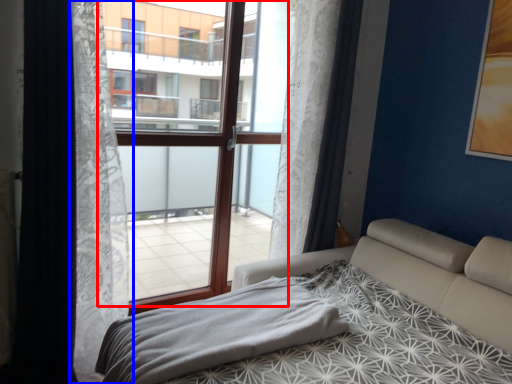
Question: Which point is further to the camera, window frame (highlighted by a red box) or curtain (highlighted by a blue box)?

Choices:
 (A) window frame
 (B) curtain

Answer: (A)